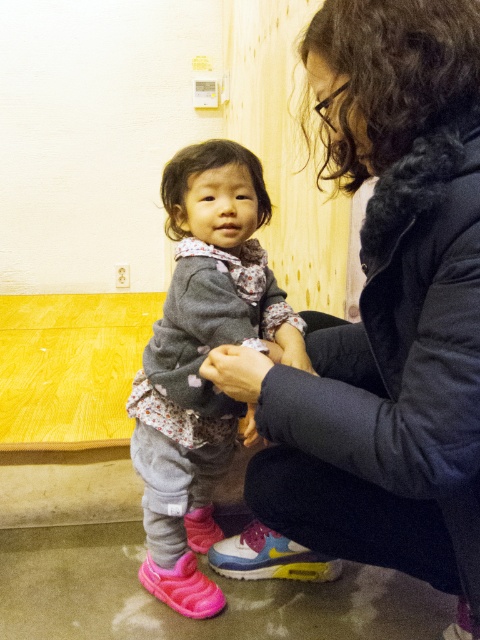
Question: Considering the relative positions of matte black jacket at center and matte gray sweater at center in the image provided, where is matte black jacket at center located with respect to matte gray sweater at center?

Choices:
 (A) below
 (B) above

Answer: (B)

Question: Which object appears closest to the camera in this image?

Choices:
 (A) matte black jacket at center
 (B) matte gray sweater at center

Answer: (A)

Question: Which object appears closest to the camera in this image?

Choices:
 (A) matte black jacket at center
 (B) matte gray sweater at center

Answer: (A)

Question: Is matte black jacket at center bigger than matte gray sweater at center?

Choices:
 (A) yes
 (B) no

Answer: (B)

Question: Among these points, which one is farthest from the camera?

Choices:
 (A) (176, 413)
 (B) (376, 541)

Answer: (A)

Question: In this image, where is matte black jacket at center located relative to matte gray sweater at center?

Choices:
 (A) right
 (B) left

Answer: (A)